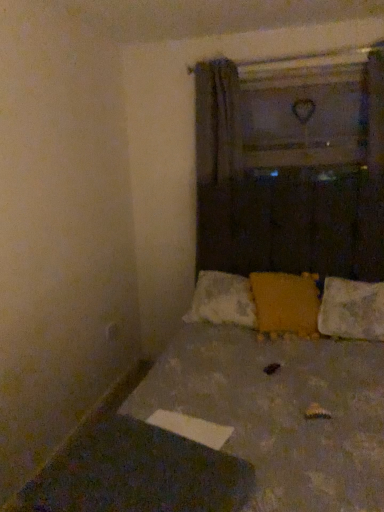
Question: Does matte yellow pillow at center, which ranks as the first pillow in left-to-right order, have a lesser width compared to textured fabric bed at center?

Choices:
 (A) no
 (B) yes

Answer: (B)

Question: Considering the relative sizes of matte yellow pillow at center, which is the second pillow from right to left, and textured fabric bed at center in the image provided, is matte yellow pillow at center, which is the second pillow from right to left, taller than textured fabric bed at center?

Choices:
 (A) yes
 (B) no

Answer: (B)

Question: Would you consider matte yellow pillow at center, which ranks as the first pillow in left-to-right order, to be distant from textured fabric bed at center?

Choices:
 (A) yes
 (B) no

Answer: (B)

Question: Does matte yellow pillow at center, which is the second pillow from right to left, appear on the right side of textured fabric bed at center?

Choices:
 (A) no
 (B) yes

Answer: (B)

Question: Can you confirm if matte yellow pillow at center, which is the second pillow from right to left, is bigger than textured fabric bed at center?

Choices:
 (A) no
 (B) yes

Answer: (A)

Question: Is matte yellow pillow at center, which ranks as the first pillow in left-to-right order, outside of textured fabric bed at center?

Choices:
 (A) no
 (B) yes

Answer: (A)

Question: Considering the relative positions of textured fabric bed at center and matte yellow pillow at center, which ranks as the first pillow in left-to-right order, in the image provided, is textured fabric bed at center behind matte yellow pillow at center, which ranks as the first pillow in left-to-right order,?

Choices:
 (A) no
 (B) yes

Answer: (A)

Question: Is textured fabric bed at center at the left side of matte yellow pillow at center, which ranks as the first pillow in left-to-right order?

Choices:
 (A) yes
 (B) no

Answer: (A)

Question: From the image's perspective, would you say textured fabric bed at center is positioned over matte yellow pillow at center, which is the second pillow from right to left?

Choices:
 (A) no
 (B) yes

Answer: (A)

Question: From a real-world perspective, is textured fabric bed at center beneath matte yellow pillow at center, which ranks as the first pillow in left-to-right order?

Choices:
 (A) no
 (B) yes

Answer: (B)

Question: Is textured fabric bed at center placed right next to matte yellow pillow at center, which is the second pillow from right to left?

Choices:
 (A) no
 (B) yes

Answer: (A)

Question: Does textured fabric bed at center have a greater height compared to matte yellow pillow at center, which ranks as the first pillow in left-to-right order?

Choices:
 (A) no
 (B) yes

Answer: (B)

Question: Is white textured pillow at lower right, marked as the second pillow in a left-to-right arrangement, in front of matte yellow pillow at center, which ranks as the first pillow in left-to-right order?

Choices:
 (A) no
 (B) yes

Answer: (B)